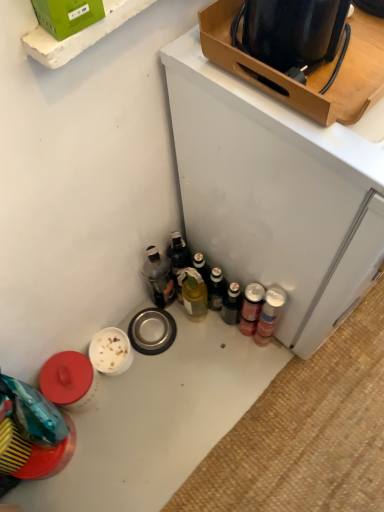
The height and width of the screenshot is (512, 384). Find the location of `free location in front of translucent glass bottle at center, marked as the 1th bottle in a left-to-right arrangement`. free location in front of translucent glass bottle at center, marked as the 1th bottle in a left-to-right arrangement is located at coordinates (182, 355).